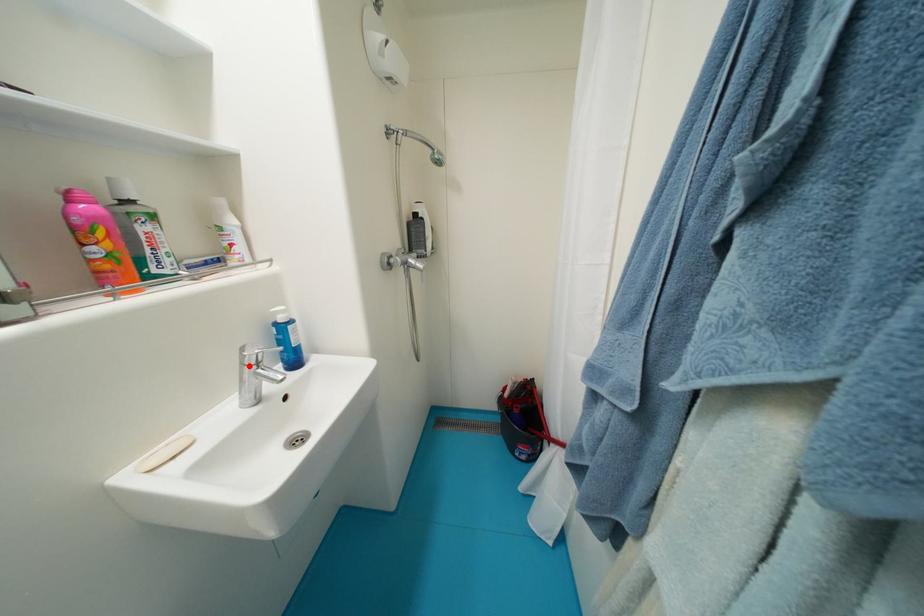
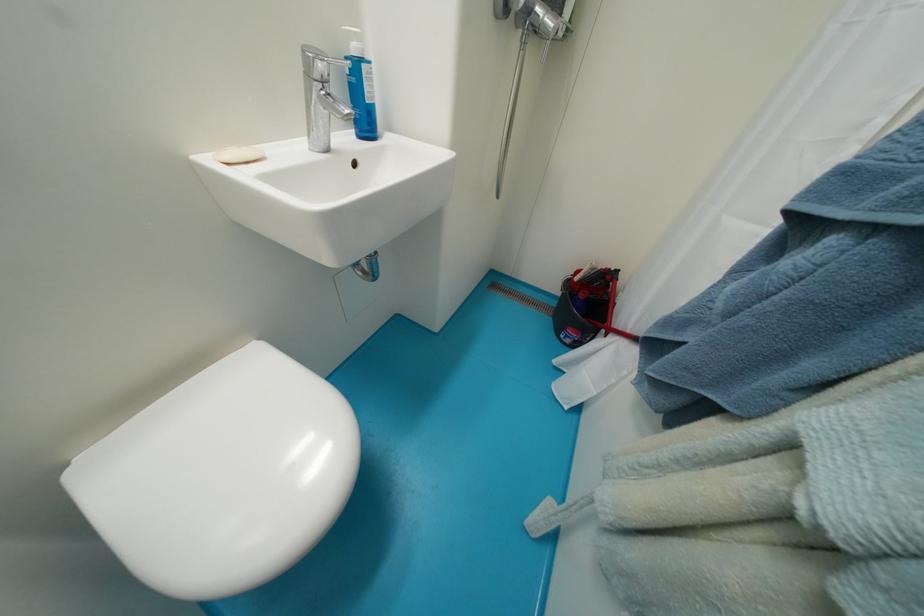
The point at the highlighted location is marked in the first image. Where is the corresponding point in the second image?

(313, 78)